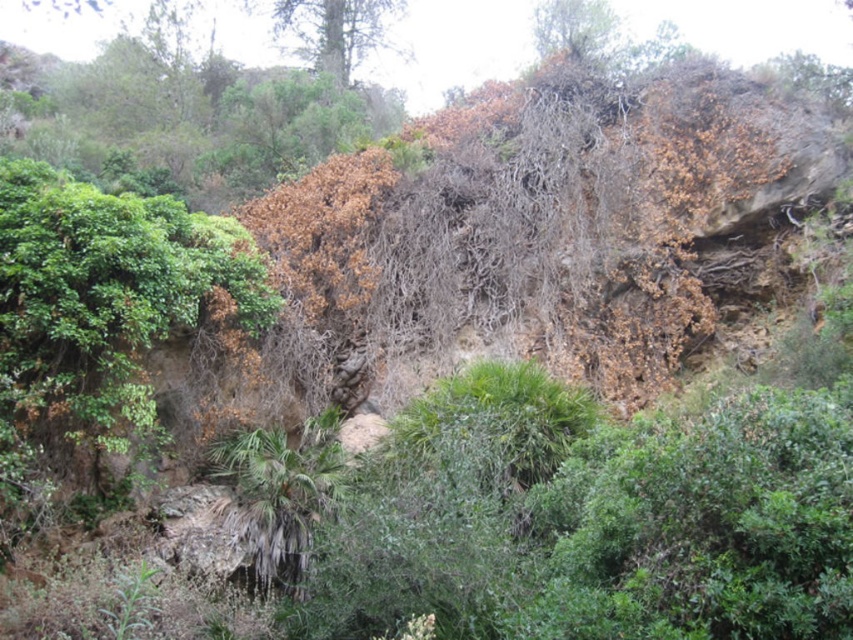
You are standing in the natural landscape scene. There are two points marked in the image. The first point is at coordinate point (337, 51) and the second is at point (537, 12). If you want to reach both points starting from your current position, which point should you reach first?

You should reach point (337, 51) first because it is closer to you than point (537, 12), which is further away.

You are a hiker who wants to cross between the two trees at the upper center. The path between them is narrow. Your backpack is 1.2 meters wide. Can you safely pass through the path between the green leafy tree at upper center and the brown textured tree at upper center?

The distance between the green leafy tree at upper center and the brown textured tree at upper center is 12.08 meters. Since your backpack is only 1.2 meters wide, you can safely pass through the path between them as the distance is much wider than your backpack.